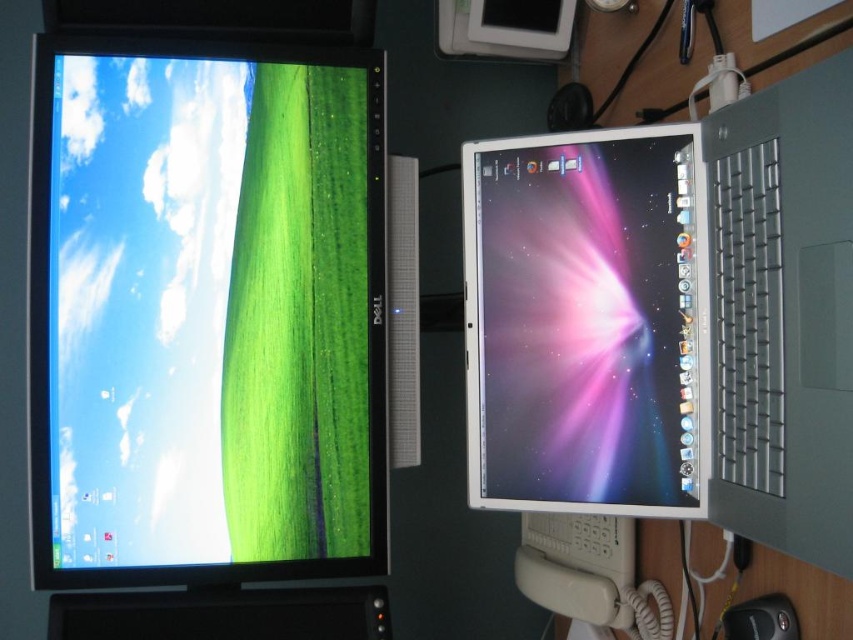
Question: Which point appears closest to the camera in this image?

Choices:
 (A) (798, 637)
 (B) (230, 273)

Answer: (A)

Question: Is satin silver laptop at right above black plastic mouse at lower right?

Choices:
 (A) no
 (B) yes

Answer: (B)

Question: Which object appears farthest from the camera in this image?

Choices:
 (A) matte black monitor at left
 (B) satin silver laptop at right

Answer: (A)

Question: Is matte black monitor at left in front of black plastic mouse at lower right?

Choices:
 (A) no
 (B) yes

Answer: (A)

Question: Which object is closer to the camera taking this photo?

Choices:
 (A) satin silver laptop at right
 (B) matte black monitor at left
 (C) metallic silver laptop at center

Answer: (A)

Question: Can you confirm if satin silver laptop at right is wider than metallic silver laptop at center?

Choices:
 (A) no
 (B) yes

Answer: (B)